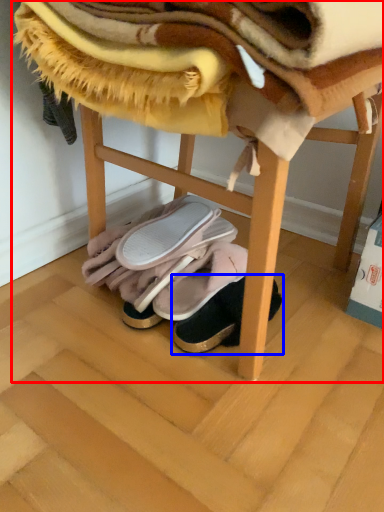
Question: Which object appears closest to the camera in this image, furniture (highlighted by a red box) or footwear (highlighted by a blue box)?

Choices:
 (A) furniture
 (B) footwear

Answer: (A)